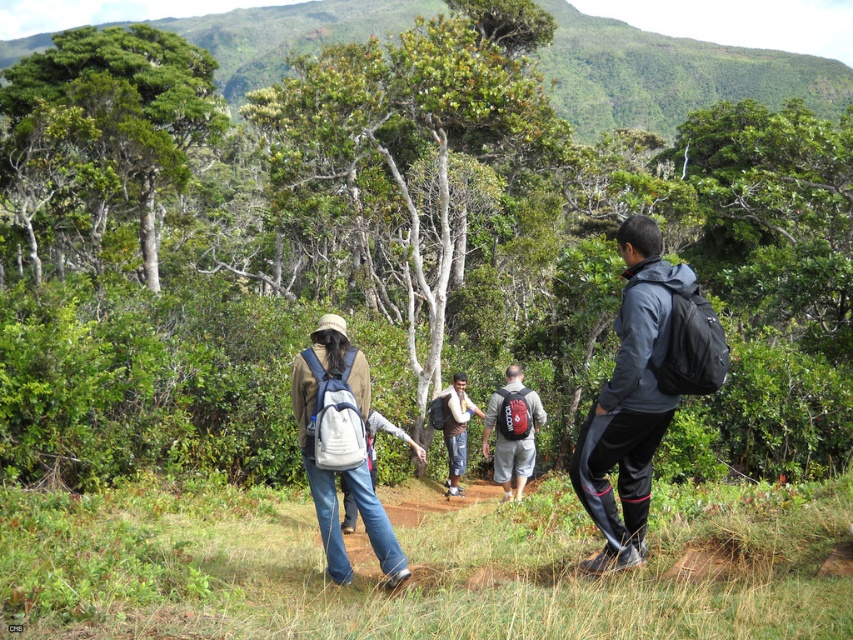
Question: Based on their relative distances, which object is nearer to the white fabric backpack at center?

Choices:
 (A) green matte tree at upper left
 (B) matte white backpack at center-left

Answer: (B)

Question: Observing the image, what is the correct spatial positioning of reddish-brown backpack at center in reference to white fabric backpack at center?

Choices:
 (A) right
 (B) left

Answer: (A)

Question: Can you confirm if green leafy tree at center is positioned to the right of matte gray jacket at center?

Choices:
 (A) no
 (B) yes

Answer: (A)

Question: Estimate the real-world distances between objects in this image. Which object is farther from the green matte tree at upper left?

Choices:
 (A) matte white backpack at center-left
 (B) white fabric backpack at center

Answer: (A)

Question: Is green matte tree at upper left positioned at the back of matte white backpack at center-left?

Choices:
 (A) yes
 (B) no

Answer: (A)

Question: Based on their relative distances, which object is nearer to the green matte tree at upper left?

Choices:
 (A) white fabric backpack at center
 (B) reddish-brown backpack at center
 (C) matte white backpack at center-left

Answer: (A)